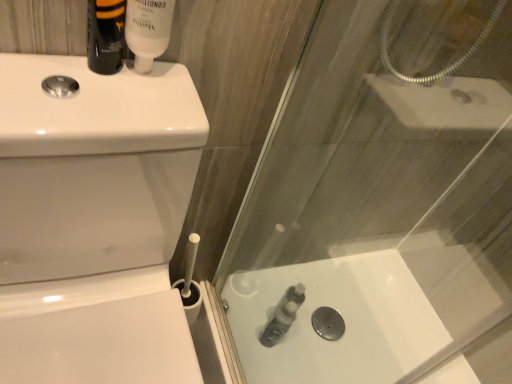
Where is `empty space that is to the right of matte black bottle at upper left, the first toiletry viewed from the left`? The height and width of the screenshot is (384, 512). empty space that is to the right of matte black bottle at upper left, the first toiletry viewed from the left is located at coordinates (156, 94).